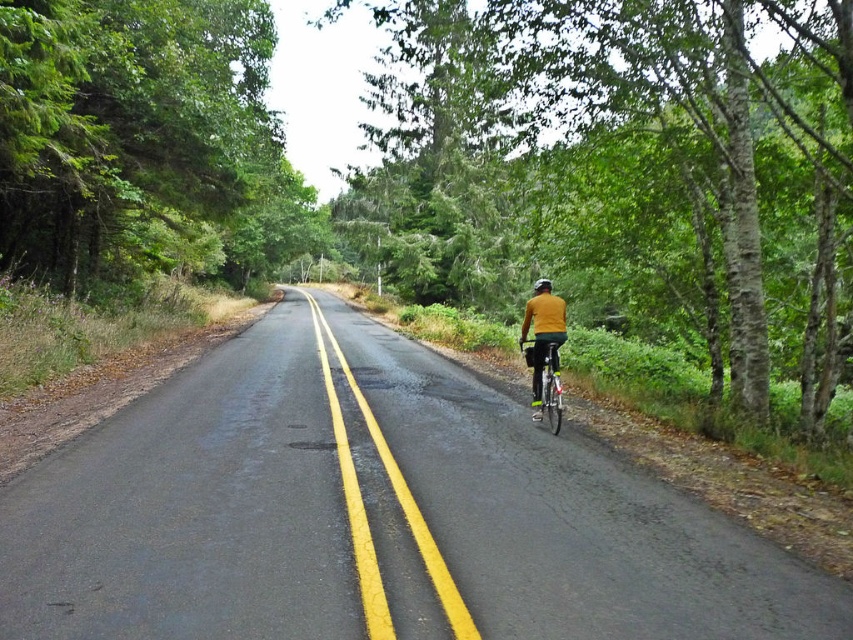
From the picture: Is green leafy tree at center bigger than black matte helmet at upper center?

Correct, green leafy tree at center is larger in size than black matte helmet at upper center.

Can you confirm if green leafy tree at center is thinner than black matte helmet at upper center?

Incorrect, green leafy tree at center's width is not less than black matte helmet at upper center's.

The width and height of the screenshot is (853, 640). I want to click on green leafy tree at center, so click(x=625, y=168).

Does green leafy tree at center have a lesser width compared to yellow matte shirt at center?

In fact, green leafy tree at center might be wider than yellow matte shirt at center.

Who is lower down, green leafy tree at center or yellow matte shirt at center?

yellow matte shirt at center is lower down.

Locate an element on the screen. green leafy tree at center is located at coordinates (625, 168).

Between green leafy tree at center and green leafy tree at left, which one has less height?

green leafy tree at left is shorter.

Measure the distance between green leafy tree at center and camera.

green leafy tree at center and camera are 8.76 meters apart from each other.

Locate an element on the screen. This screenshot has height=640, width=853. green leafy tree at center is located at coordinates (625, 168).